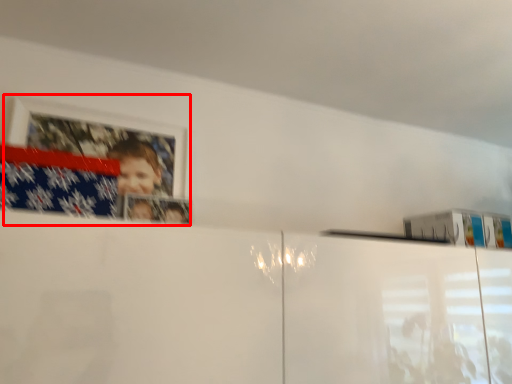
Question: Observing the image, what is the correct spatial positioning of picture frame (annotated by the red box) in reference to flag?

Choices:
 (A) left
 (B) right

Answer: (B)